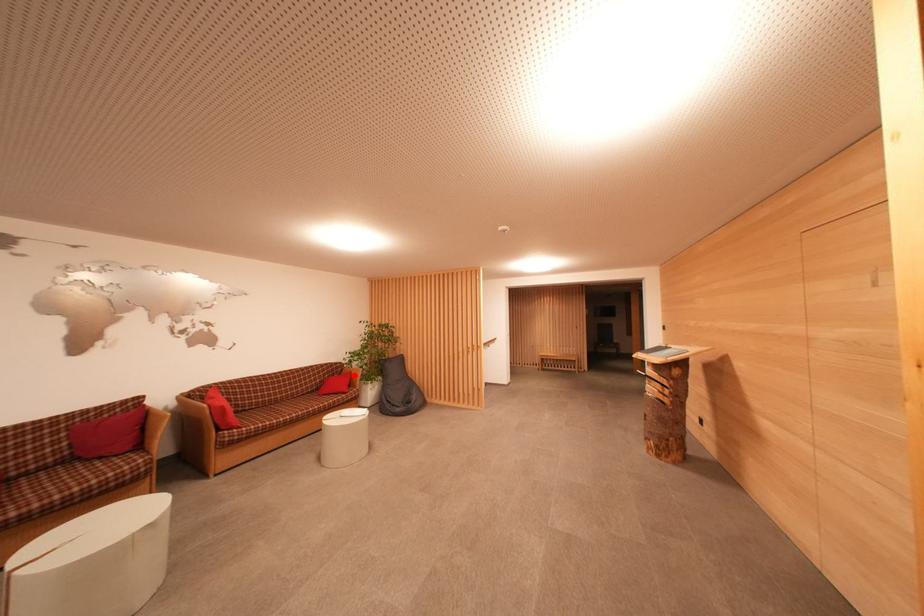
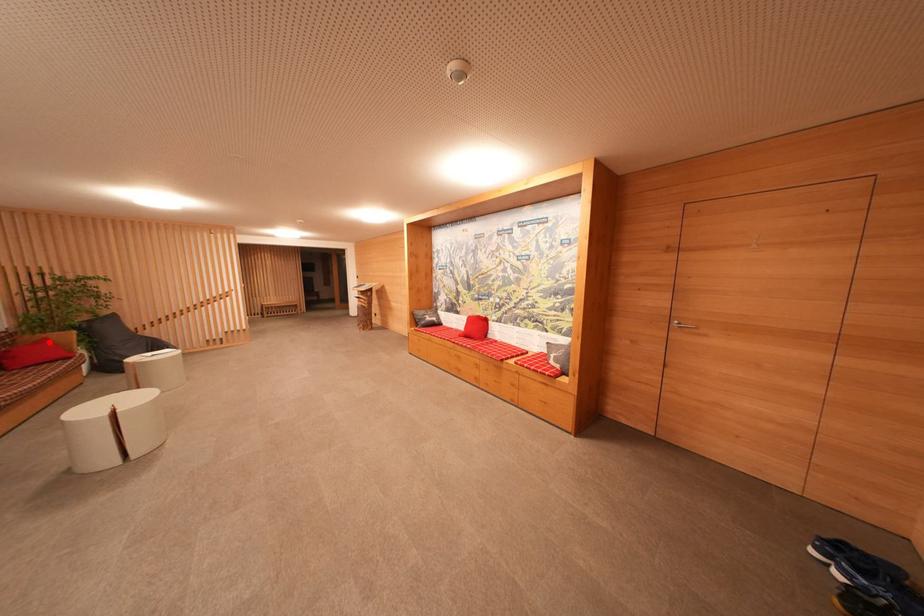
I am providing you with two images of the same scene from different viewpoints. A red point is marked on the first image and another point is marked on the second image. Is the red point in image1 aligned with the point shown in image2?

Yes